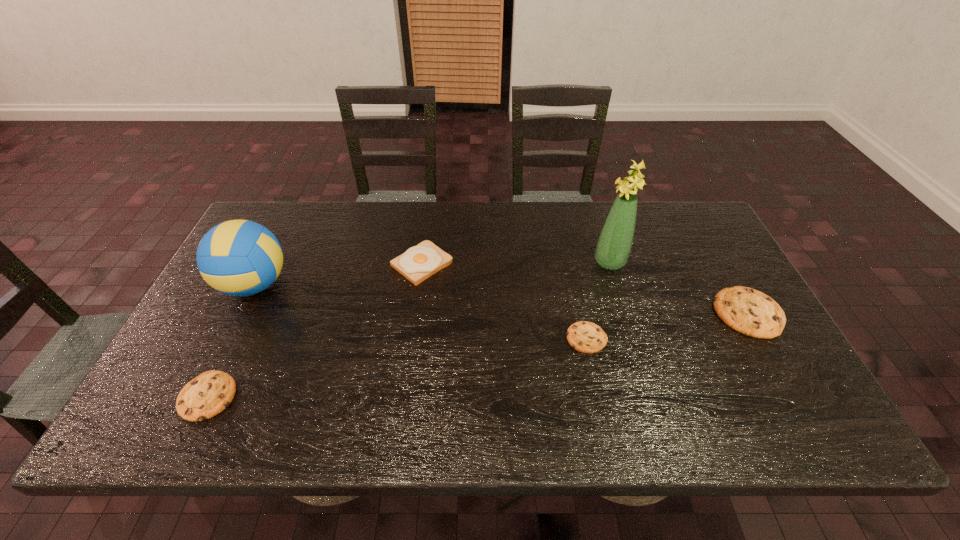
Find the location of `the nearest object`. the nearest object is located at coordinates (207, 395).

Locate an element on the screen. the leftmost cookie is located at coordinates (207, 395).

You are a GUI agent. You are given a task and a screenshot of the screen. Output one action in this format:
    pyautogui.click(x=<x>, y=<y>)
    Task: Click on the third object from right to left
    The width and height of the screenshot is (960, 540).
    Given the screenshot: What is the action you would take?
    pyautogui.click(x=586, y=337)

You are a GUI agent. You are given a task and a screenshot of the screen. Output one action in this format:
    pyautogui.click(x=<x>, y=<y>)
    Task: Click on the second cookie from left to right
    The image size is (960, 540).
    Given the screenshot: What is the action you would take?
    pyautogui.click(x=586, y=337)

Find the location of a particular element. Image resolution: width=960 pixels, height=540 pixels. the third shortest object is located at coordinates (748, 311).

Where is `the rightmost cookie`? This screenshot has width=960, height=540. the rightmost cookie is located at coordinates (748, 311).

You are a GUI agent. You are given a task and a screenshot of the screen. Output one action in this format:
    pyautogui.click(x=<x>, y=<y>)
    Task: Click on the volleyball
    The height and width of the screenshot is (540, 960).
    Given the screenshot: What is the action you would take?
    pyautogui.click(x=238, y=257)

Identify the location of the third object from left to right. This screenshot has width=960, height=540. (418, 263).

Where is `bouquet`? This screenshot has width=960, height=540. bouquet is located at coordinates (614, 245).

At what (x,y) coordinates should I click in order to perform the action: click on the tallest object. Please return your answer as a coordinate pair (x, y). The image size is (960, 540). Looking at the image, I should click on (614, 245).